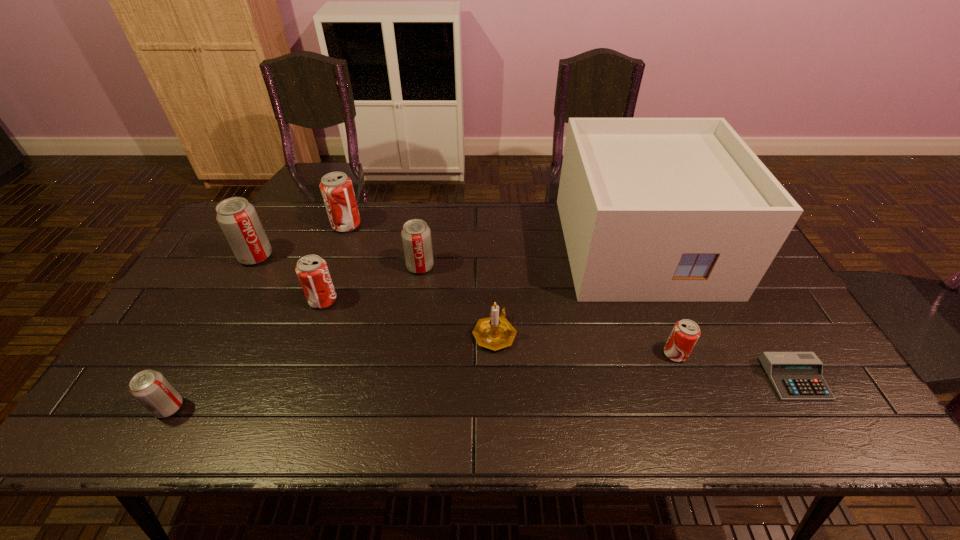
Where is `candle holder`? Image resolution: width=960 pixels, height=540 pixels. candle holder is located at coordinates (495, 332).

Where is `the second nearest soda can`? This screenshot has width=960, height=540. the second nearest soda can is located at coordinates (685, 333).

The width and height of the screenshot is (960, 540). Identify the location of the smallest pink soda can. (685, 333).

This screenshot has height=540, width=960. In order to click on the nearest soda can in this screenshot , I will do `click(150, 388)`.

Identify the location of the smallest gray soda can. This screenshot has height=540, width=960. (150, 388).

The image size is (960, 540). Identify the location of the shortest object. (796, 376).

The image size is (960, 540). What are the coordinates of `calculator` in the screenshot? It's located at (796, 376).

Locate an element on the screen. This screenshot has height=540, width=960. free space located 0.280m on the side of the box with the window is located at coordinates (697, 389).

Where is `vacant area located 0.130m on the front of the farthest pink soda can`? Image resolution: width=960 pixels, height=540 pixels. vacant area located 0.130m on the front of the farthest pink soda can is located at coordinates (334, 261).

I want to click on free space located on the front of the biggest gray soda can, so coord(215,333).